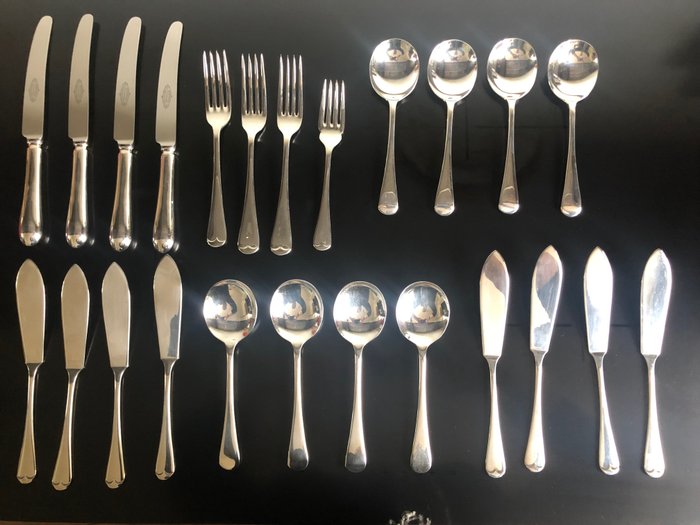
At what (x,y) coordinates should I click in order to perform the action: click on forks. Please return your answer as a coordinate pair (x, y). Looking at the image, I should click on (218, 107), (248, 112), (287, 122), (318, 127).